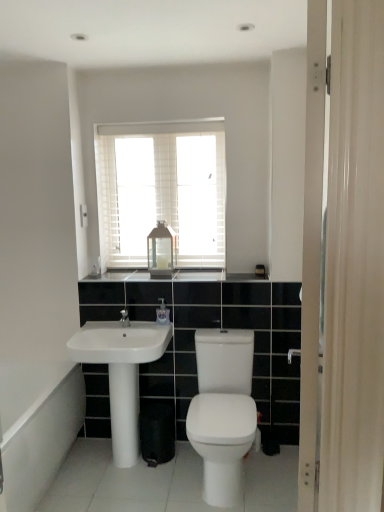
Locate an element on the screen. The height and width of the screenshot is (512, 384). clear plastic soap dispenser at center is located at coordinates (162, 313).

Locate an element on the screen. white glossy bidet at center is located at coordinates (221, 442).

The width and height of the screenshot is (384, 512). Find the location of `white wooden blinds at upper center`. white wooden blinds at upper center is located at coordinates (162, 190).

In order to face white wooden blinds at upper center, should I rotate leftwards or rightwards?

Rotate left and turn 3.924 degrees.

What do you see at coordinates (124, 413) in the screenshot? I see `white glossy pillar at center` at bounding box center [124, 413].

This screenshot has width=384, height=512. I want to click on white glossy sink at lower left, so click(x=119, y=342).

This screenshot has width=384, height=512. Describe the element at coordinates (216, 276) in the screenshot. I see `black granite countertop at center` at that location.

Find the location of a particular element. clear plastic soap dispenser at center is located at coordinates (162, 313).

You are a GUI agent. You are given a task and a screenshot of the screen. Output one action in this format:
    pyautogui.click(x=<x>, y=<y>)
    Task: Click on the bath that appears in front of the white glossy pillar at center
    
    Given the screenshot: What is the action you would take?
    pyautogui.click(x=38, y=432)

Who is smaller, white glossy bath at lower left or white glossy pillar at center?

white glossy pillar at center is smaller.

Is white glossy bath at lower left facing away from white glossy pillar at center?

white glossy bath at lower left does not have its back to white glossy pillar at center.

Identify the location of counter top positioned vertically above the white glossy pillar at center (from a real-world perspective). This screenshot has width=384, height=512. (216, 276).

Would you say white glossy pillar at center is a long distance from black granite countertop at center?

No, there isn't a large distance between white glossy pillar at center and black granite countertop at center.

Between point (130, 408) and point (201, 276), which one is positioned behind?

The point (201, 276) is behind.

Would you say clear plastic soap dispenser at center is outside white glossy bath at lower left?

Yes, clear plastic soap dispenser at center is located beyond the bounds of white glossy bath at lower left.

Based on the photo, considering the sizes of objects clear plastic soap dispenser at center and white glossy bath at lower left in the image provided, who is taller, clear plastic soap dispenser at center or white glossy bath at lower left?

white glossy bath at lower left is taller.

Looking at this image, from the image's perspective, which object appears higher, clear plastic soap dispenser at center or white glossy bath at lower left?

clear plastic soap dispenser at center, from the image's perspective.

Is there a large distance between black granite countertop at center and white glossy pillar at center?

No.

This screenshot has height=512, width=384. Identify the location of pillar below the black granite countertop at center (from a real-world perspective). (124, 413).

Is the depth of black granite countertop at center greater than that of white glossy pillar at center?

Yes, black granite countertop at center is behind white glossy pillar at center.

Which object is wider, white glossy bath at lower left or clear plastic soap dispenser at center?

With larger width is white glossy bath at lower left.

How many degrees apart are the facing directions of white glossy bath at lower left and clear plastic soap dispenser at center?

white glossy bath at lower left and clear plastic soap dispenser at center are facing 90.8 degrees away from each other.

Is clear plastic soap dispenser at center at the back of white glossy bath at lower left?

white glossy bath at lower left is not turned away from clear plastic soap dispenser at center.

Does white glossy bath at lower left have a smaller size compared to clear plastic soap dispenser at center?

Incorrect, white glossy bath at lower left is not smaller in size than clear plastic soap dispenser at center.

Between white wooden blinds at upper center and clear plastic soap dispenser at center, which one has larger width?

Wider between the two is white wooden blinds at upper center.

Which is more to the right, white wooden blinds at upper center or clear plastic soap dispenser at center?

clear plastic soap dispenser at center.

Is point (177, 266) more distant than point (162, 307)?

Yes, point (177, 266) is behind point (162, 307).

From the picture: Is clear plastic soap dispenser at center further to camera compared to white glossy bidet at center?

Yes, it is.

From a real-world perspective, who is located lower, clear plastic soap dispenser at center or white glossy bidet at center?

A: white glossy bidet at center is physically lower.

Considering the sizes of clear plastic soap dispenser at center and white glossy bidet at center in the image, is clear plastic soap dispenser at center bigger or smaller than white glossy bidet at center?

Considering their sizes, clear plastic soap dispenser at center takes up less space than white glossy bidet at center.

Is white glossy bidet at center a part of clear plastic soap dispenser at center?

No.

Image resolution: width=384 pixels, height=512 pixels. I want to click on pillar above the white glossy bath at lower left (from the image's perspective), so click(124, 413).

In the image, there is a black granite countertop at center. Where is `pillar below it (from a real-world perspective)`? The width and height of the screenshot is (384, 512). pillar below it (from a real-world perspective) is located at coordinates (124, 413).

Considering their positions, is white wooden blinds at upper center positioned closer to clear plastic soap dispenser at center than black granite countertop at center?

Based on the image, black granite countertop at center appears to be nearer to clear plastic soap dispenser at center.

Estimate the real-world distances between objects in this image. Which object is closer to white glossy pillar at center, matte glass lantern at center or white wooden blinds at upper center?

matte glass lantern at center.

Based on their spatial positions, is white wooden blinds at upper center or white glossy sink at lower left closer to white glossy bath at lower left?

Among the two, white glossy sink at lower left is located nearer to white glossy bath at lower left.

When comparing their distances from white glossy bidet at center, does white glossy bath at lower left or clear plastic soap dispenser at center seem further?

The object further to white glossy bidet at center is white glossy bath at lower left.

Looking at the image, which one is located closer to white glossy pillar at center, matte glass lantern at center or black granite countertop at center?

black granite countertop at center is positioned closer to the anchor white glossy pillar at center.

Looking at the image, which one is located further to white glossy bath at lower left, white glossy bidet at center or clear plastic soap dispenser at center?

Answer: Based on the image, clear plastic soap dispenser at center appears to be further to white glossy bath at lower left.

From the image, which object appears to be nearer to white glossy bidet at center, white glossy bath at lower left or matte glass lantern at center?

white glossy bath at lower left lies closer to white glossy bidet at center than the other object.

Considering their positions, is black granite countertop at center positioned closer to white glossy bidet at center than white wooden blinds at upper center?

black granite countertop at center.

The width and height of the screenshot is (384, 512). I want to click on sink located between white glossy bidet at center and clear plastic soap dispenser at center in the depth direction, so click(119, 342).

The image size is (384, 512). I want to click on counter top that lies between white wooden blinds at upper center and clear plastic soap dispenser at center from top to bottom, so click(216, 276).

Identify the location of pillar between white glossy bidet at center and clear plastic soap dispenser at center from front to back. (124, 413).

Find the location of a particular element. This screenshot has width=384, height=512. counter top between white wooden blinds at upper center and white glossy sink at lower left in the vertical direction is located at coordinates (216, 276).